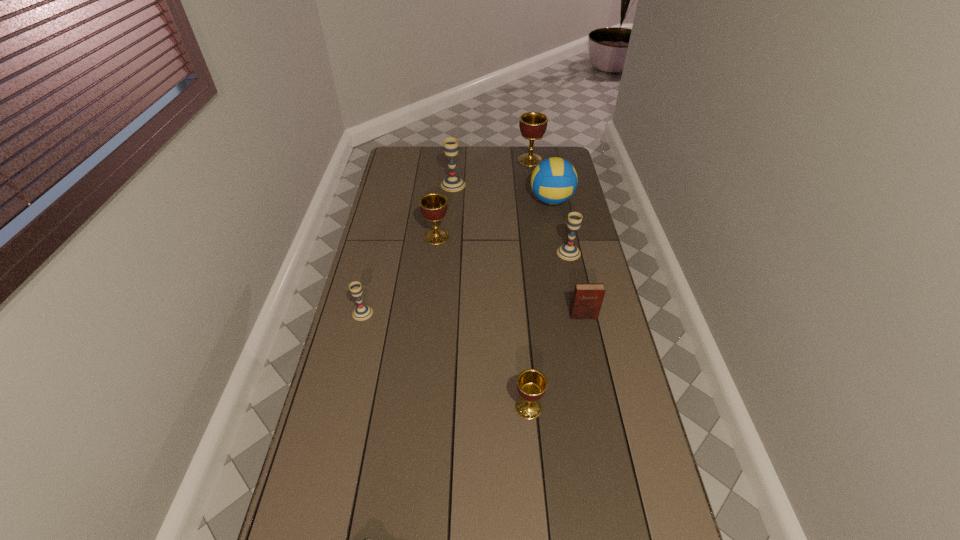
Find the location of a particular element. The height and width of the screenshot is (540, 960). vacant area situated 0.050m on the left of the second golden chalice from left to right is located at coordinates (496, 407).

Find the location of a particular element. The height and width of the screenshot is (540, 960). free region located 0.150m on the right of the leftmost chalice is located at coordinates pos(416,313).

Where is `object that is at the far edge`? object that is at the far edge is located at coordinates (533, 125).

This screenshot has width=960, height=540. In order to click on object that is at the left edge in this screenshot , I will do `click(362, 312)`.

Find the location of `volleyball located in the right edge section of the desktop`. volleyball located in the right edge section of the desktop is located at coordinates (554, 180).

Identify the location of diary that is at the right edge. This screenshot has height=540, width=960. (587, 300).

What are the coordinates of `object present at the far right corner` in the screenshot? It's located at (533, 125).

In the image, there is a desktop. Identify the location of vacant space at the far edge. (511, 153).

In the image, there is a desktop. Where is `vacant space at the left edge`? vacant space at the left edge is located at coordinates (407, 206).

At what (x,y) coordinates should I click in order to perform the action: click on free space at the right edge. Please return your answer as a coordinate pair (x, y). This screenshot has width=960, height=540. Looking at the image, I should click on (612, 461).